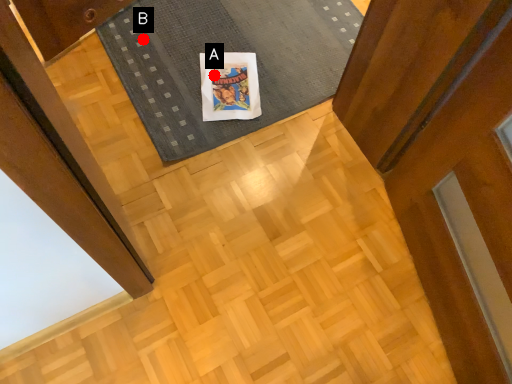
Question: Two points are circled on the image, labeled by A and B beside each circle. Which point is farther to the camera?

Choices:
 (A) A is further
 (B) B is further

Answer: (B)